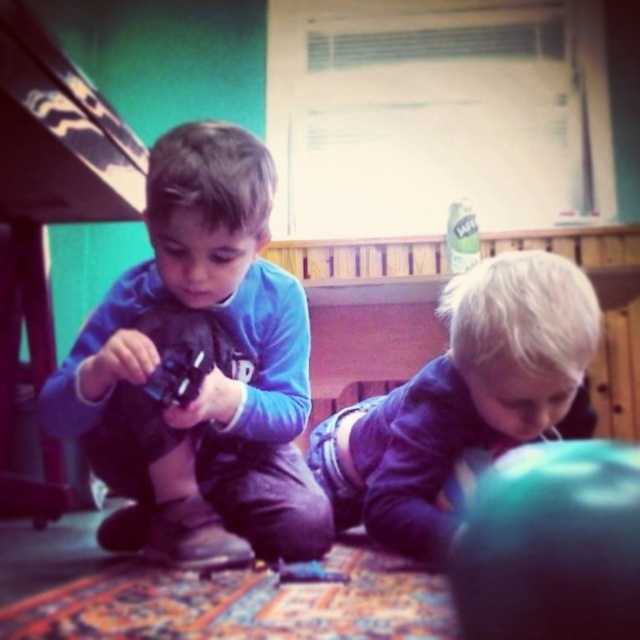
You are a parent trying to hand a toy to your child. You are standing at the center of the room and see the matte blue shirt at center and the purple denim shorts at lower right. Which child is closer to you?

Both the matte blue shirt at center and purple denim shorts at lower right are 14.72 inches apart from each other, but since the matte blue shirt at center is positioned at the center, it is closer to you than the purple denim shorts at lower right.

You are a parent trying to take a photo of your children. You want to ensure both the matte blue shirt at center and the purple denim shorts at lower right are clearly visible in the shot. Based on their positions, which child might you need to ask to move slightly forward to avoid being blocked?

The purple denim shorts at lower right is behind the matte blue shirt at center, so you should ask the child wearing the purple denim shorts at lower right to move forward to avoid being blocked.

Looking at this image, you are a parent trying to locate a missing button in the room. The button is at point (x=205, y=352). Where would you find the missing button?

The missing button is on the matte blue shirt at center, so you would find it there.